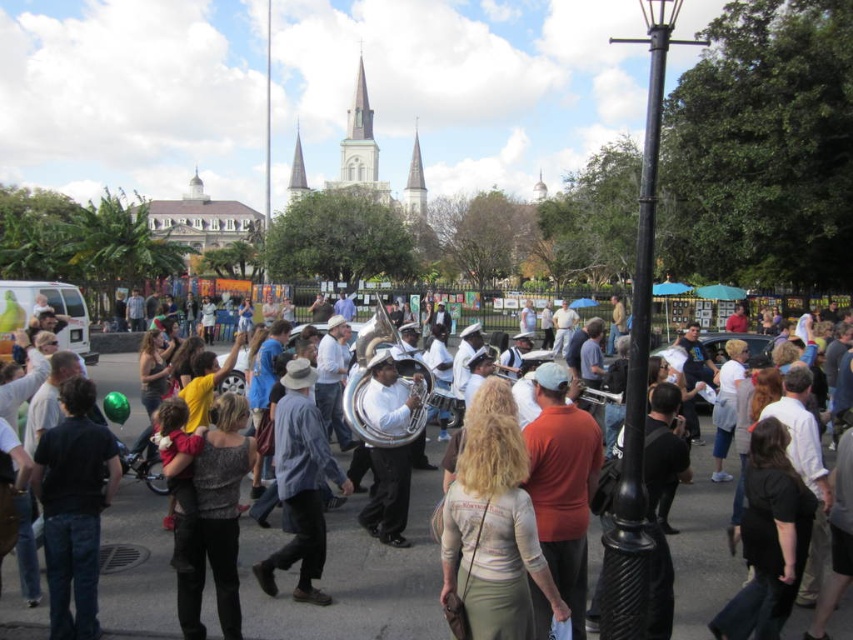
Question: Does white shirt at center appear on the left side of blue plaid shirt at center?

Choices:
 (A) no
 (B) yes

Answer: (A)

Question: Which point is farther to the camera?

Choices:
 (A) (303, 497)
 (B) (328, 609)

Answer: (A)

Question: Which point is farther from the camera taking this photo?

Choices:
 (A) (329, 600)
 (B) (213, 628)

Answer: (A)

Question: Is white shirt at center below blue plaid shirt at center?

Choices:
 (A) no
 (B) yes

Answer: (B)

Question: Does white shirt at center come behind blue plaid shirt at center?

Choices:
 (A) no
 (B) yes

Answer: (A)